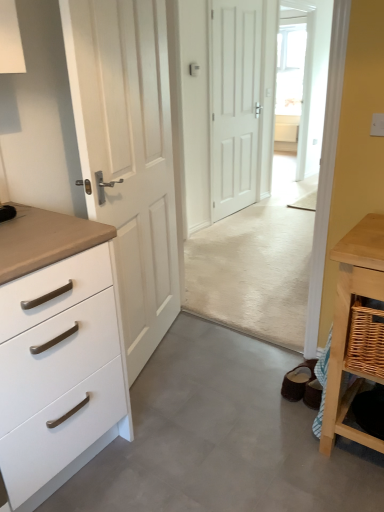
Question: Should I look upward or downward to see transparent glass door at upper center?

Choices:
 (A) up
 (B) down

Answer: (A)

Question: Is woven wood basket at lower right far away from white wood door at left, positioned as the 1th door in left-to-right order?

Choices:
 (A) yes
 (B) no

Answer: (A)

Question: Does woven wood basket at lower right come behind white wood door at left, which ranks as the first door in front-to-back order?

Choices:
 (A) yes
 (B) no

Answer: (A)

Question: Is woven wood basket at lower right smaller than white wood door at left, arranged as the second door when viewed from the right?

Choices:
 (A) no
 (B) yes

Answer: (B)

Question: Is woven wood basket at lower right thinner than white wood door at left, positioned as the second door in back-to-front order?

Choices:
 (A) no
 (B) yes

Answer: (A)

Question: Could you tell me if woven wood basket at lower right is turned towards white wood door at left, positioned as the 1th door in left-to-right order?

Choices:
 (A) no
 (B) yes

Answer: (A)

Question: From the image's perspective, is woven wood basket at lower right over white wood door at left, arranged as the second door when viewed from the right?

Choices:
 (A) yes
 (B) no

Answer: (B)

Question: Is woven wood table at right positioned behind white wood door at left, positioned as the 1th door in left-to-right order?

Choices:
 (A) no
 (B) yes

Answer: (B)

Question: Is the surface of woven wood table at right in direct contact with white wood door at left, which ranks as the first door in front-to-back order?

Choices:
 (A) yes
 (B) no

Answer: (B)

Question: Is white wood door at left, positioned as the second door in back-to-front order, completely or partially inside woven wood table at right?

Choices:
 (A) no
 (B) yes

Answer: (A)

Question: Considering the relative sizes of woven wood table at right and white wood door at left, positioned as the 1th door in left-to-right order, in the image provided, is woven wood table at right smaller than white wood door at left, positioned as the 1th door in left-to-right order,?

Choices:
 (A) no
 (B) yes

Answer: (B)

Question: Is woven wood table at right taller than white wood door at left, positioned as the second door in back-to-front order?

Choices:
 (A) no
 (B) yes

Answer: (A)

Question: Is woven wood table at right shorter than white wood door at left, arranged as the second door when viewed from the right?

Choices:
 (A) no
 (B) yes

Answer: (B)

Question: Is woven wood basket at lower right bigger than white matte door at center, positioned as the second door in front-to-back order?

Choices:
 (A) yes
 (B) no

Answer: (B)